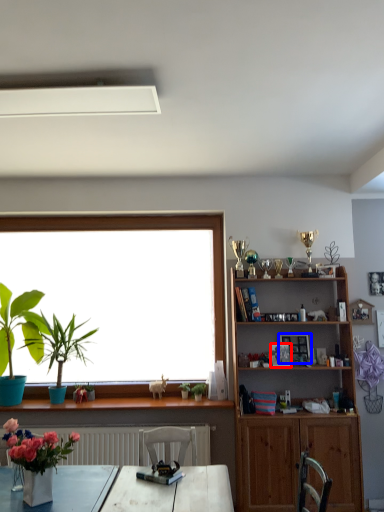
Question: Which object appears closest to the camera in this image, picture frame (highlighted by a red box) or picture frame (highlighted by a blue box)?

Choices:
 (A) picture frame
 (B) picture frame

Answer: (A)